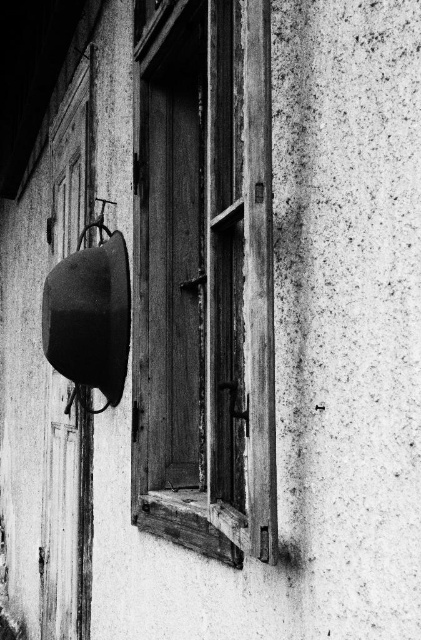
Does wooden window at center have a larger size compared to metallic smooth pot at left?

Indeed, wooden window at center has a larger size compared to metallic smooth pot at left.

Which is below, wooden window at center or metallic smooth pot at left?

wooden window at center

Is point (191, 189) positioned after point (55, 358)?

No, it is in front of (55, 358).

Identify the location of wooden window at center. (204, 276).

Between wooden at left and metallic smooth pot at left, which one is positioned lower?

wooden at left is below.

Does wooden at left appear on the left side of metallic smooth pot at left?

Yes, wooden at left is to the left of metallic smooth pot at left.

Find the location of a particular element. The width and height of the screenshot is (421, 640). wooden at left is located at coordinates [x=66, y=518].

Is wooden window at center to the right of wooden at left from the viewer's perspective?

Yes, wooden window at center is to the right of wooden at left.

How much distance is there between wooden window at center and wooden at left?

5.08 feet

Identify the location of wooden window at center. (204, 276).